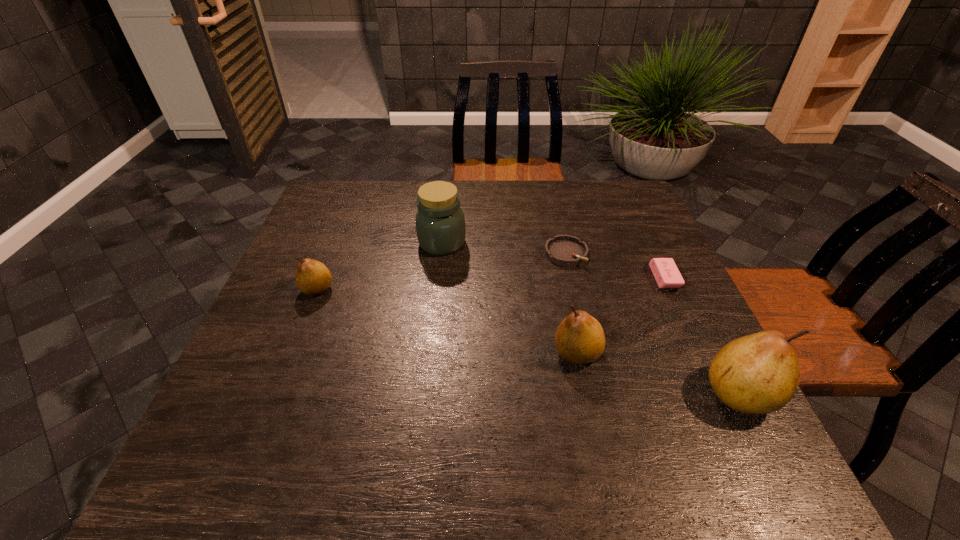
Locate an element on the screen. The image size is (960, 540). vacant space in between the leftmost object and the eraser is located at coordinates (491, 284).

The image size is (960, 540). I want to click on free spot between the ashtray and the second object from left to right, so click(x=504, y=248).

The height and width of the screenshot is (540, 960). Find the location of `blank region between the second pear from right to left and the fifth object from right to left`. blank region between the second pear from right to left and the fifth object from right to left is located at coordinates (510, 298).

The image size is (960, 540). I want to click on blank region between the fourth shortest object and the rightmost pear, so click(x=658, y=373).

Choose which object is the second nearest neighbor to the ashtray. Please provide its 2D coordinates. Your answer should be formatted as a tuple, i.e. [(x, y)], where the tuple contains the x and y coordinates of a point satisfying the conditions above.

[(440, 223)]

Choose which object is the third nearest neighbor to the eraser. Please provide its 2D coordinates. Your answer should be formatted as a tuple, i.e. [(x, y)], where the tuple contains the x and y coordinates of a point satisfying the conditions above.

[(579, 339)]

Locate an element on the screen. The height and width of the screenshot is (540, 960). pear that can be found as the third closest to the ashtray is located at coordinates 313,278.

Identify which pear is the second nearest to the shortest pear. Please provide its 2D coordinates. Your answer should be formatted as a tuple, i.e. [(x, y)], where the tuple contains the x and y coordinates of a point satisfying the conditions above.

[(755, 374)]

Locate an element on the screen. blank area in the image that satisfies the following two spatial constraints: 1. on the front side of the ashtray; 2. on the right side of the eraser is located at coordinates (571, 278).

Locate an element on the screen. Image resolution: width=960 pixels, height=540 pixels. free space that satisfies the following two spatial constraints: 1. on the front side of the fourth shortest object; 2. on the right side of the fifth object from right to left is located at coordinates (430, 353).